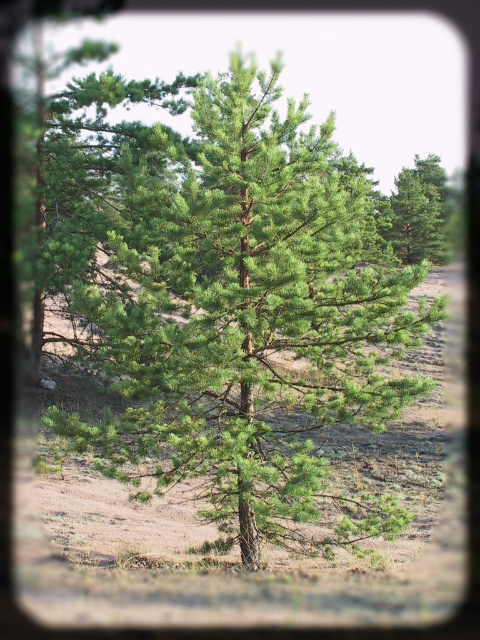
Question: Which of the following is the farthest from the observer?

Choices:
 (A) (136, 317)
 (B) (443, 179)

Answer: (B)

Question: Is green needle-like tree at center above green matte tree at upper center?

Choices:
 (A) yes
 (B) no

Answer: (B)

Question: Observing the image, what is the correct spatial positioning of green needle-like tree at center in reference to green matte tree at upper center?

Choices:
 (A) right
 (B) left

Answer: (B)

Question: Where is green needle-like tree at center located in relation to green matte tree at upper center in the image?

Choices:
 (A) left
 (B) right

Answer: (A)